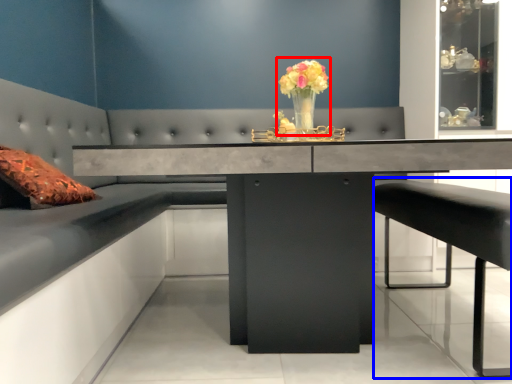
Question: Which of the following is the farthest to the observer, floral arrangement (highlighted by a red box) or bar stool (highlighted by a blue box)?

Choices:
 (A) floral arrangement
 (B) bar stool

Answer: (A)